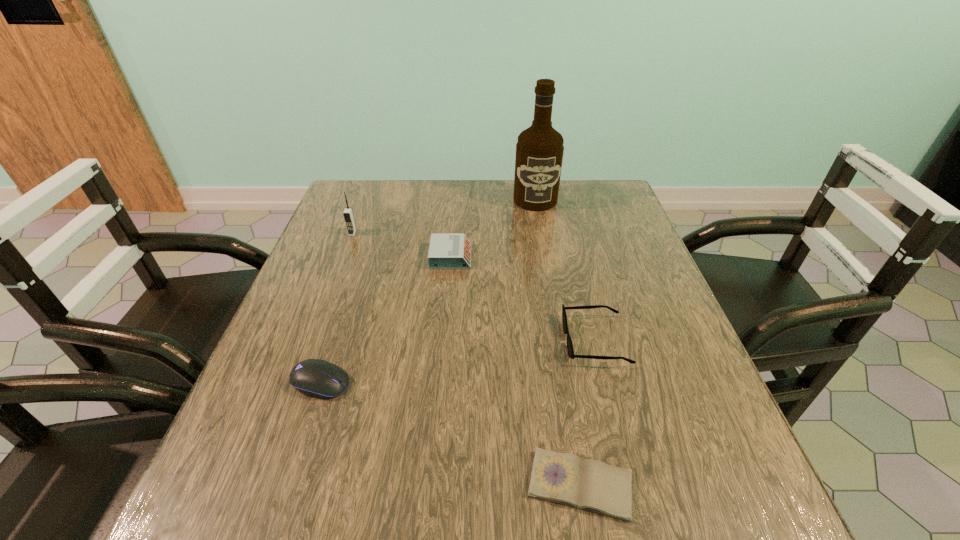
I want to click on free area in between the tallest object and the sunglasses, so click(x=565, y=270).

This screenshot has height=540, width=960. I want to click on free space between the sunglasses and the computer mouse, so 458,361.

In order to click on empty space between the diary and the third object from left to right in this screenshot , I will do `click(516, 370)`.

Identify the location of vacant space that's between the sunglasses and the second farthest object. The height and width of the screenshot is (540, 960). (474, 287).

The image size is (960, 540). I want to click on empty space that is in between the computer mouse and the sunglasses, so click(x=458, y=361).

This screenshot has height=540, width=960. Find the location of `vacant area that lies between the alarm clock and the tallest object`. vacant area that lies between the alarm clock and the tallest object is located at coordinates (492, 228).

Image resolution: width=960 pixels, height=540 pixels. Find the location of `free space between the sunglasses and the alarm clock`. free space between the sunglasses and the alarm clock is located at coordinates (523, 299).

At what (x,y) coordinates should I click in order to perform the action: click on vacant space that's between the diary and the computer mouse. Please return your answer as a coordinate pair (x, y). Looking at the image, I should click on click(450, 434).

At what (x,y) coordinates should I click in order to perform the action: click on free space between the third object from left to right and the computer mouse. Please return your answer as a coordinate pair (x, y). Looking at the image, I should click on (386, 320).

Choose which object is the nearest neighbor to the third farthest object. Please provide its 2D coordinates. Your answer should be formatted as a tuple, i.e. [(x, y)], where the tuple contains the x and y coordinates of a point satisfying the conditions above.

[(539, 151)]